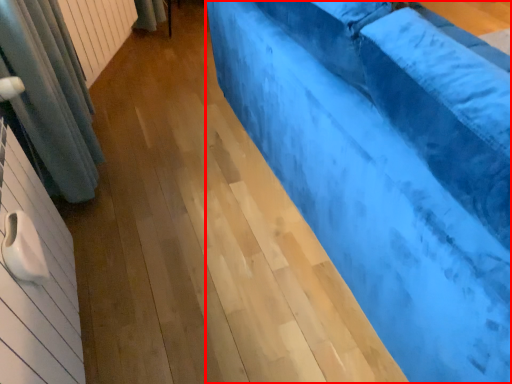
Question: Considering the relative positions of furniture (annotated by the red box) and radiator in the image provided, where is furniture (annotated by the red box) located with respect to the staircase?

Choices:
 (A) left
 (B) right

Answer: (B)